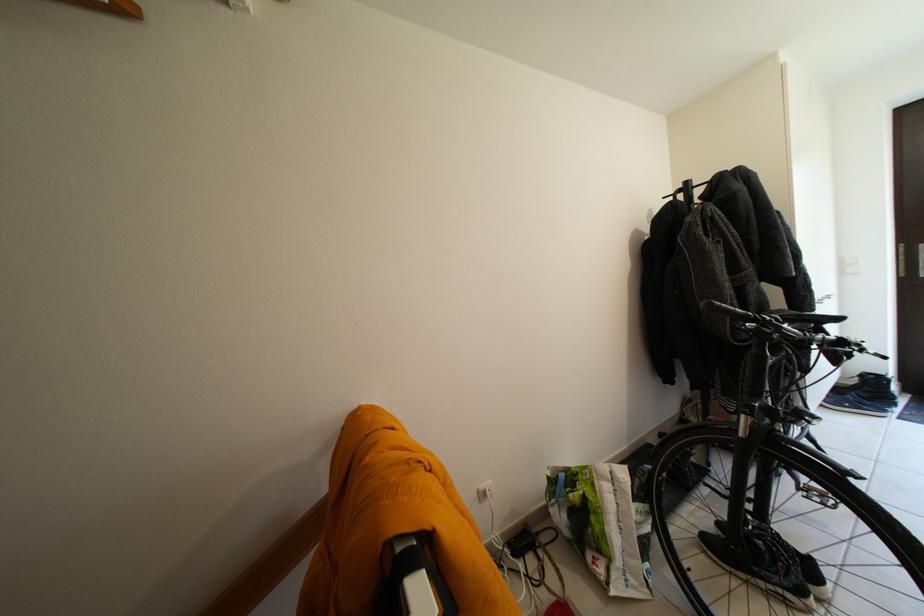
I want to click on black bicycle pedal, so click(x=818, y=496).